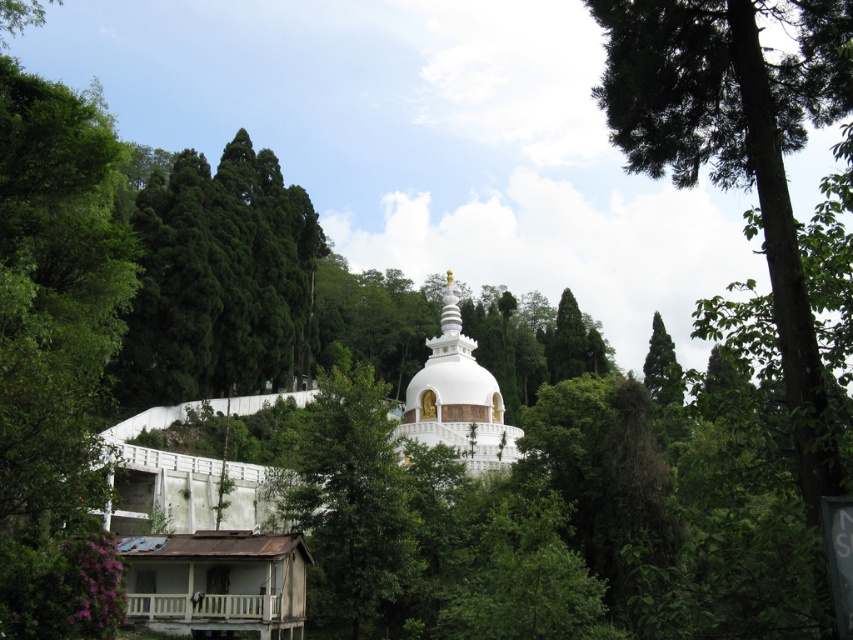
Can you confirm if green glossy tree at upper left is taller than green leafy tree at center?

Indeed, green glossy tree at upper left has a greater height compared to green leafy tree at center.

Is point (218, 232) closer to camera compared to point (354, 570)?

No.

Is point (189, 152) farther from camera compared to point (354, 628)?

Yes.

Where is `green glossy tree at upper left`? This screenshot has width=853, height=640. green glossy tree at upper left is located at coordinates tap(218, 278).

Between green glossy tree at upper left and green leafy tree at upper right, which one has less height?

green leafy tree at upper right

Which is more to the left, green glossy tree at upper left or green leafy tree at upper right?

green glossy tree at upper left

Identify the location of green glossy tree at upper left. This screenshot has height=640, width=853. (218, 278).

Can you confirm if green leafy tree at upper center is positioned above white glossy stupa at center?

Yes, green leafy tree at upper center is above white glossy stupa at center.

Is green leafy tree at upper center below white glossy stupa at center?

No.

Image resolution: width=853 pixels, height=640 pixels. Find the location of `green leafy tree at upper center`. green leafy tree at upper center is located at coordinates (738, 148).